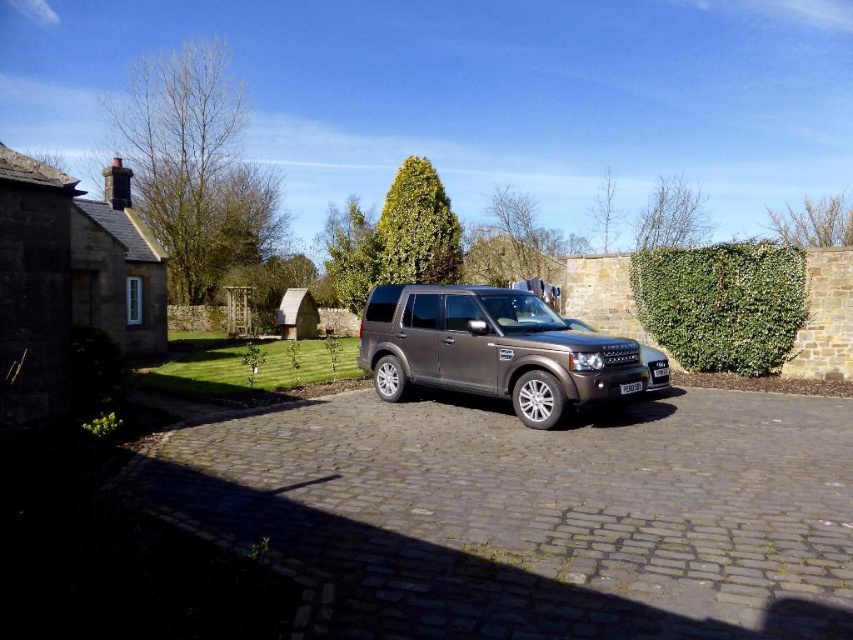
Question: Among these objects, which one is nearest to the camera?

Choices:
 (A) brown cobblestone driveway at center
 (B) metallic gray suv at center

Answer: (A)

Question: Does metallic gray suv at center have a lesser width compared to black plastic license plate at center?

Choices:
 (A) no
 (B) yes

Answer: (A)

Question: In this image, where is metallic gray suv at center located relative to black plastic license plate at center?

Choices:
 (A) below
 (B) above

Answer: (B)

Question: Is brown cobblestone driveway at center smaller than black plastic license plate at center?

Choices:
 (A) yes
 (B) no

Answer: (B)

Question: Among these points, which one is farthest from the camera?

Choices:
 (A) (630, 390)
 (B) (805, 531)
 (C) (796, 289)
 (D) (442, 344)

Answer: (C)

Question: Which point is closer to the camera?

Choices:
 (A) (640, 385)
 (B) (445, 593)

Answer: (B)